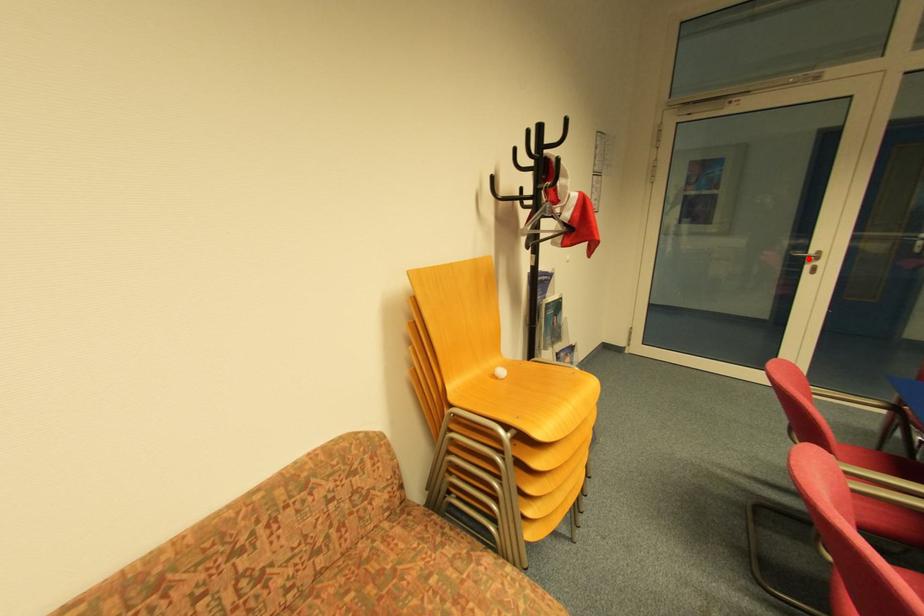
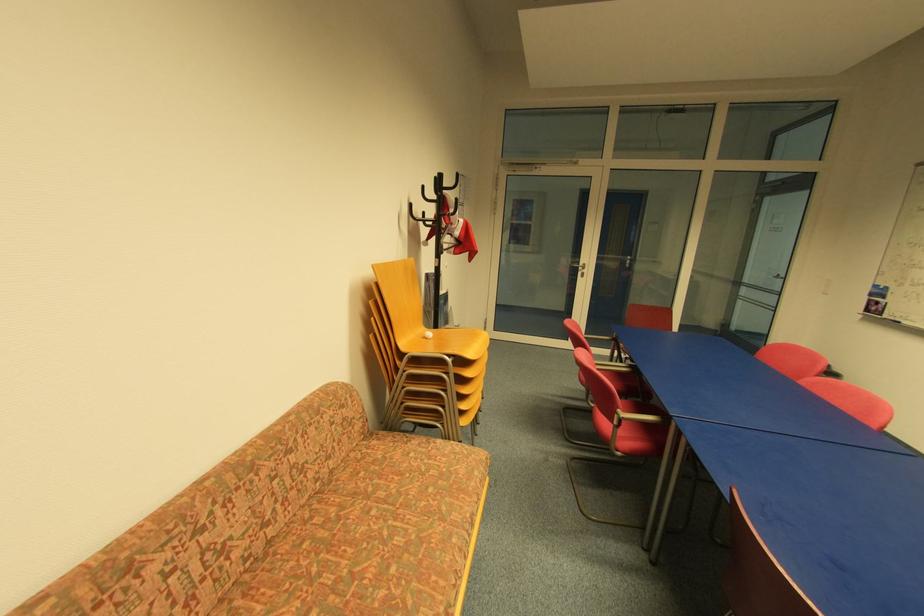
Where in the second image is the point corresponding to the highlighted location from the first image?

(581, 269)